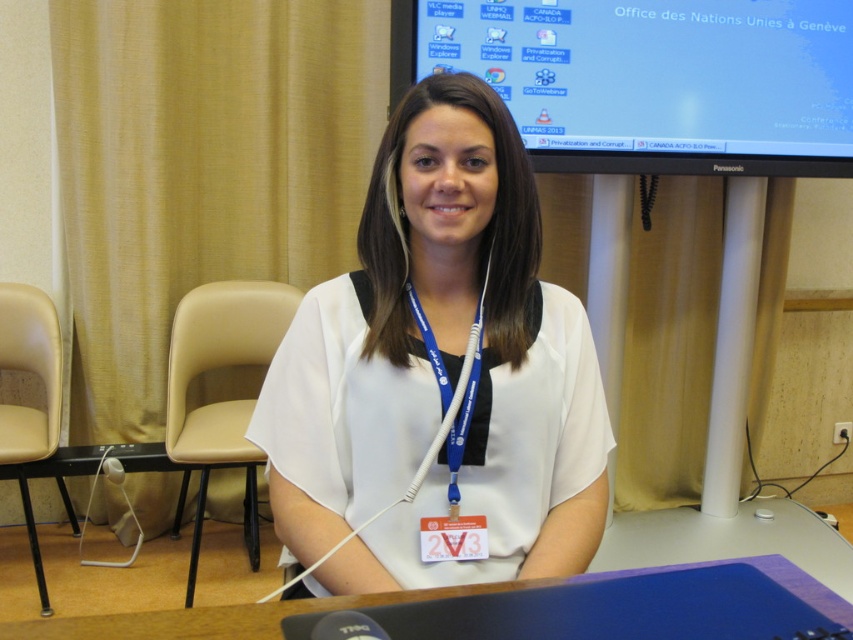
You are a technician setting up equipment for a UN meeting. You need to place a camera that requires a 2.2 meter clearance from the white plastic table at center to ensure optimal performance. Is the current placement sufficient?

The white plastic table at center and camera are 2.19 meters apart from each other. Since 2.19 meters is slightly less than the required 2.2 meters, the current placement does not meet the clearance requirement. The camera needs to be moved back approximately 1 centimeter to achieve the necessary distance.

You are a fashion designer analyzing the proportions of clothing items in the image. The white matte shirt at center and the skinny white neck at center are both visible. Which of these two items appears taller in the image?

The white matte shirt at center appears taller than the skinny white neck at center in the image.